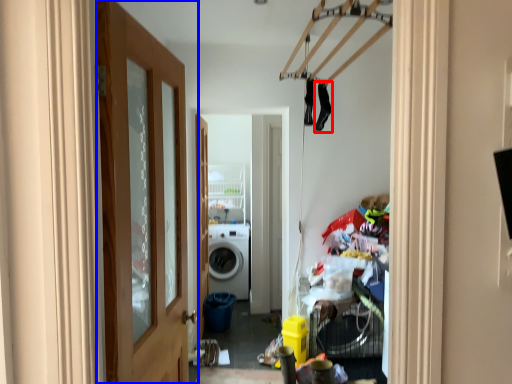
Question: Which point is further to the camera, clothing (highlighted by a red box) or door (highlighted by a blue box)?

Choices:
 (A) clothing
 (B) door

Answer: (A)